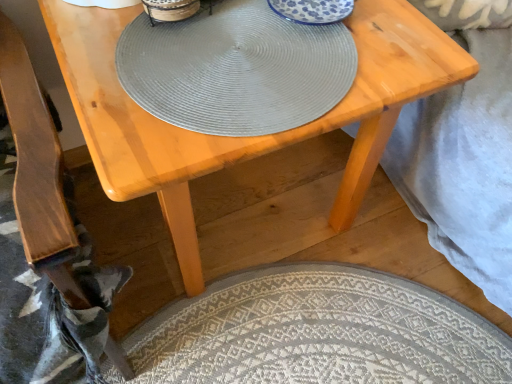
What is the approximate height of wooden armchair at lower left?

30.79 inches.

Describe the element at coordinates (316, 333) in the screenshot. This screenshot has width=512, height=384. I see `neutral woven mat at lower center` at that location.

What is the approximate width of matte gray placemat at center?

matte gray placemat at center is 14.06 inches wide.

The height and width of the screenshot is (384, 512). In order to click on matte gray placemat at center in this screenshot , I will do `click(170, 10)`.

Are matte gray placemat at center and wooden armchair at lower left making contact?

matte gray placemat at center and wooden armchair at lower left are not in contact.

Is matte gray placemat at center oriented away from wooden armchair at lower left?

matte gray placemat at center does not have its back to wooden armchair at lower left.

Is matte gray placemat at center to the left of wooden armchair at lower left from the viewer's perspective?

Incorrect, matte gray placemat at center is not on the left side of wooden armchair at lower left.

Considering the relative positions of neutral woven mat at lower center and wooden armchair at lower left in the image provided, is neutral woven mat at lower center behind wooden armchair at lower left?

Yes, the depth of neutral woven mat at lower center is greater than that of wooden armchair at lower left.

Locate an element on the screen. mat behind the wooden armchair at lower left is located at coordinates (316, 333).

Looking at this image, are neutral woven mat at lower center and wooden armchair at lower left making contact?

No, neutral woven mat at lower center is not making contact with wooden armchair at lower left.

Is neutral woven mat at lower center taller or shorter than wooden armchair at lower left?

Clearly, neutral woven mat at lower center is shorter compared to wooden armchair at lower left.

From a real-world perspective, is matte gray placemat at center above or below light wood table at center?

In terms of real-world spatial position, matte gray placemat at center is above light wood table at center.

Does matte gray placemat at center have a larger size compared to light wood table at center?

Incorrect, matte gray placemat at center is not larger than light wood table at center.

Considering the positions of points (152, 4) and (91, 120), is point (152, 4) closer to camera compared to point (91, 120)?

No, it is behind (91, 120).

How far apart are matte gray placemat at center and light wood table at center?

matte gray placemat at center and light wood table at center are 12.25 inches apart.

Would you say matte gray placemat at center is outside neutral woven mat at lower center?

Yes, matte gray placemat at center is outside of neutral woven mat at lower center.

Can you confirm if matte gray placemat at center is smaller than neutral woven mat at lower center?

Yes, matte gray placemat at center is smaller than neutral woven mat at lower center.

Between matte gray placemat at center and neutral woven mat at lower center, which one has larger width?

neutral woven mat at lower center.

Considering the positions of point (283, 87) and point (199, 348), is point (283, 87) closer or farther from the camera than point (199, 348)?

Point (283, 87) appears to be closer to the viewer than point (199, 348).

Could you tell me if wooden armchair at lower left is turned towards neutral woven mat at lower center?

No, wooden armchair at lower left is not oriented towards neutral woven mat at lower center.

Between wooden armchair at lower left and neutral woven mat at lower center, which one has smaller width?

wooden armchair at lower left is thinner.

Is the surface of wooden armchair at lower left in direct contact with neutral woven mat at lower center?

There is a gap between wooden armchair at lower left and neutral woven mat at lower center.

Is the position of wooden armchair at lower left less distant than that of neutral woven mat at lower center?

Yes, wooden armchair at lower left is closer to the viewer.

Considering the sizes of neutral woven mat at lower center and light wood table at center in the image, is neutral woven mat at lower center taller or shorter than light wood table at center?

neutral woven mat at lower center is shorter than light wood table at center.

In the scene shown: Choose the correct answer: Is neutral woven mat at lower center inside light wood table at center or outside it?

neutral woven mat at lower center is not inside light wood table at center, it's outside.

Looking at their sizes, would you say neutral woven mat at lower center is wider or thinner than light wood table at center?

In the image, neutral woven mat at lower center appears to be wider than light wood table at center.

The height and width of the screenshot is (384, 512). I want to click on mat that appears below the light wood table at center (from a real-world perspective), so click(x=316, y=333).

Between light wood table at center and matte gray placemat at center, which one has smaller size?

Smaller between the two is matte gray placemat at center.

Which object is further away from the camera, light wood table at center or matte gray placemat at center?

matte gray placemat at center is further from the camera.

Is point (159, 170) closer to viewer compared to point (175, 6)?

Yes, point (159, 170) is in front of point (175, 6).

From a real-world perspective, does light wood table at center stand above matte gray placemat at center?

No, from a real-world perspective, light wood table at center is not above matte gray placemat at center.

This screenshot has width=512, height=384. Find the location of `armchair located underneath the matte gray placemat at center (from a real-world perspective)`. armchair located underneath the matte gray placemat at center (from a real-world perspective) is located at coordinates (33, 147).

Locate an element on the screen. The image size is (512, 384). mat behind the wooden armchair at lower left is located at coordinates (316, 333).

Looking at the image, which one is located further to matte gray placemat at center, light wood table at center or wooden armchair at lower left?

wooden armchair at lower left is positioned further to the anchor matte gray placemat at center.

Considering their positions, is neutral woven mat at lower center positioned closer to wooden armchair at lower left than light wood table at center?

light wood table at center.

Estimate the real-world distances between objects in this image. Which object is further from matte gray placemat at center, light wood table at center or wooden armchair at lower left?

light wood table at center.

Which object lies further to the anchor point wooden armchair at lower left, matte gray placemat at center or light wood table at center?

The object further to wooden armchair at lower left is matte gray placemat at center.

Based on their spatial positions, is wooden armchair at lower left or matte gray placemat at center closer to matte gray placemat at center?

Among the two, matte gray placemat at center is located nearer to matte gray placemat at center.

Based on their spatial positions, is wooden armchair at lower left or matte gray placemat at center further from matte gray placemat at center?

wooden armchair at lower left lies further to matte gray placemat at center than the other object.

From the image, which object appears to be farther from matte gray placemat at center, neutral woven mat at lower center or light wood table at center?

Based on the image, neutral woven mat at lower center appears to be further to matte gray placemat at center.

Which object lies further to the anchor point light wood table at center, neutral woven mat at lower center or matte gray placemat at center?

Based on the image, neutral woven mat at lower center appears to be further to light wood table at center.

Locate an element on the screen. plate between light wood table at center and matte gray placemat at center along the z-axis is located at coordinates (236, 69).

At what (x,y) coordinates should I click in order to perform the action: click on plate between wooden armchair at lower left and neutral woven mat at lower center in the horizontal direction. Please return your answer as a coordinate pair (x, y). The width and height of the screenshot is (512, 384). Looking at the image, I should click on (236, 69).

Locate an element on the screen. The image size is (512, 384). table located between wooden armchair at lower left and matte gray placemat at center in the depth direction is located at coordinates (242, 138).

You are a GUI agent. You are given a task and a screenshot of the screen. Output one action in this format:
    pyautogui.click(x=<x>, y=<y>)
    Task: Click on the table that lies between matte gray placemat at center and neutral woven mat at lower center from top to bottom
    
    Given the screenshot: What is the action you would take?
    pyautogui.click(x=242, y=138)